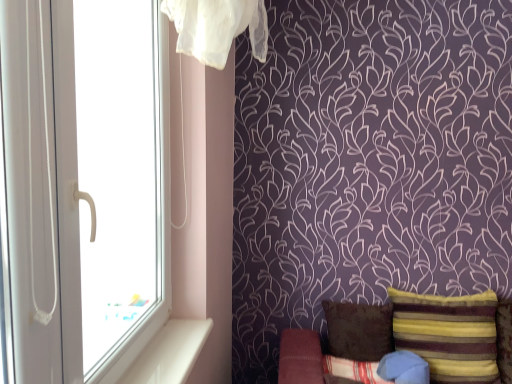
Question: Can you confirm if blue cotton pillow at lower right, which is the second pillow in left-to-right order, is smaller than white smooth window sill at lower left?

Choices:
 (A) no
 (B) yes

Answer: (A)

Question: Is blue cotton pillow at lower right, which appears as the 3th pillow when viewed from the right, wider than white smooth window sill at lower left?

Choices:
 (A) yes
 (B) no

Answer: (A)

Question: Is blue cotton pillow at lower right, which is the second pillow in left-to-right order, taller than white smooth window sill at lower left?

Choices:
 (A) no
 (B) yes

Answer: (B)

Question: Is blue cotton pillow at lower right, which appears as the 3th pillow when viewed from the right, facing towards white smooth window sill at lower left?

Choices:
 (A) yes
 (B) no

Answer: (B)

Question: Is blue cotton pillow at lower right, which appears as the 3th pillow when viewed from the right, positioned behind white smooth window sill at lower left?

Choices:
 (A) no
 (B) yes

Answer: (B)

Question: From the image's perspective, is blue cotton pillow at lower right, which is the second pillow in left-to-right order, located above white smooth window sill at lower left?

Choices:
 (A) no
 (B) yes

Answer: (A)

Question: Is brown fabric pillow at lower right, the 1th pillow in the left-to-right sequence, smaller than striped velvet pillow at lower right, positioned as the 1th pillow in right-to-left order?

Choices:
 (A) yes
 (B) no

Answer: (A)

Question: Is the position of brown fabric pillow at lower right, the 1th pillow in the left-to-right sequence, more distant than that of striped velvet pillow at lower right, marked as the 4th pillow in a left-to-right arrangement?

Choices:
 (A) yes
 (B) no

Answer: (A)

Question: From the image's perspective, is brown fabric pillow at lower right, the 1th pillow in the left-to-right sequence, beneath striped velvet pillow at lower right, marked as the 4th pillow in a left-to-right arrangement?

Choices:
 (A) yes
 (B) no

Answer: (A)

Question: Considering the relative positions of brown fabric pillow at lower right, which ranks as the 4th pillow in right-to-left order, and striped velvet pillow at lower right, marked as the 4th pillow in a left-to-right arrangement, in the image provided, is brown fabric pillow at lower right, which ranks as the 4th pillow in right-to-left order, in front of striped velvet pillow at lower right, marked as the 4th pillow in a left-to-right arrangement,?

Choices:
 (A) yes
 (B) no

Answer: (B)

Question: Is brown fabric pillow at lower right, the 1th pillow in the left-to-right sequence, placed right next to striped velvet pillow at lower right, marked as the 4th pillow in a left-to-right arrangement?

Choices:
 (A) yes
 (B) no

Answer: (B)

Question: From a real-world perspective, is brown fabric pillow at lower right, which ranks as the 4th pillow in right-to-left order, physically above striped velvet pillow at lower right, marked as the 4th pillow in a left-to-right arrangement?

Choices:
 (A) yes
 (B) no

Answer: (B)

Question: Considering the relative positions of white plastic window at left and blue cotton pillow at lower right, which appears as the 3th pillow when viewed from the right, in the image provided, is white plastic window at left to the left of blue cotton pillow at lower right, which appears as the 3th pillow when viewed from the right, from the viewer's perspective?

Choices:
 (A) yes
 (B) no

Answer: (A)